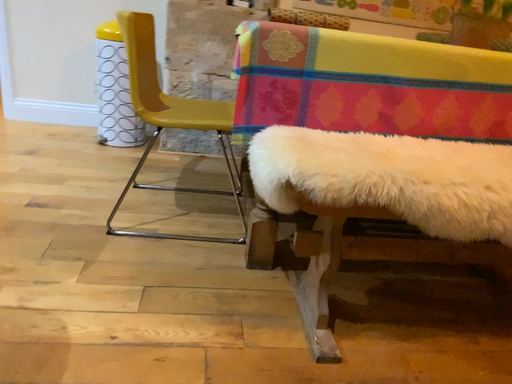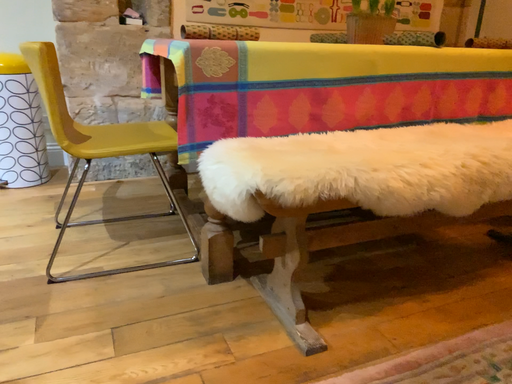
Question: How did the camera likely rotate when shooting the video?

Choices:
 (A) rotated left
 (B) rotated right

Answer: (B)